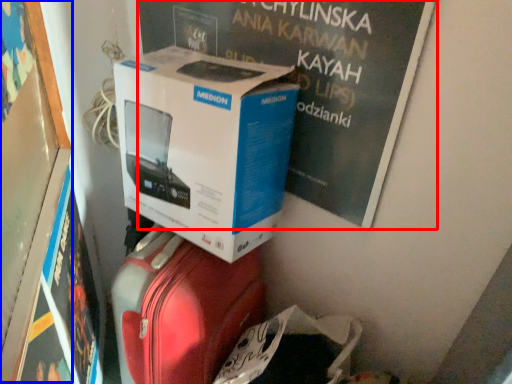
Question: Which object appears closest to the camera in this image, magazine (highlighted by a red box) or bulletin board (highlighted by a blue box)?

Choices:
 (A) magazine
 (B) bulletin board

Answer: (B)